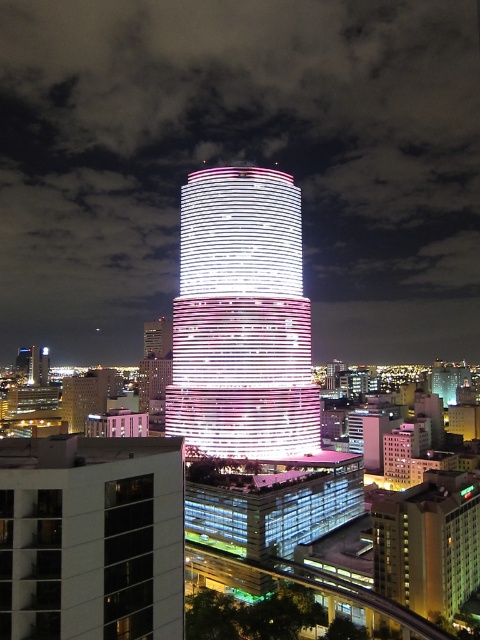
Does white glossy tower at center lie behind glassy reflective building at lower left?

That is True.

Does point (264, 282) come behind point (158, 440)?

Yes.

The height and width of the screenshot is (640, 480). In order to click on white glossy tower at center in this screenshot , I will do `click(241, 320)`.